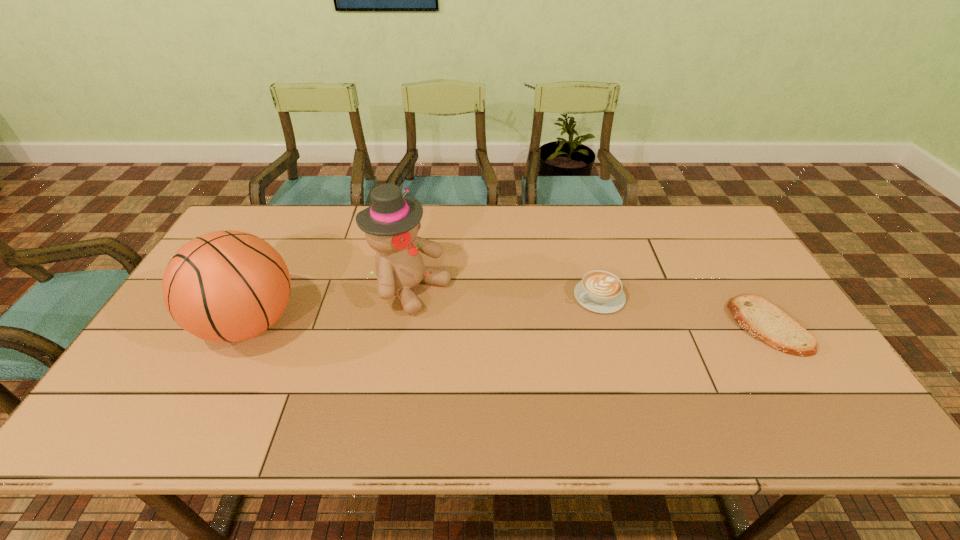
Image resolution: width=960 pixels, height=540 pixels. I want to click on free space that satisfies the following two spatial constraints: 1. on the front side of the pita bread; 2. on the left side of the rag_doll, so click(x=405, y=326).

You are a GUI agent. You are given a task and a screenshot of the screen. Output one action in this format:
    pyautogui.click(x=<x>, y=<y>)
    Task: Click on the free space that satisfies the following two spatial constraints: 1. on the front side of the rag_doll; 2. on the right side of the cappuccino
    
    Given the screenshot: What is the action you would take?
    pyautogui.click(x=410, y=296)